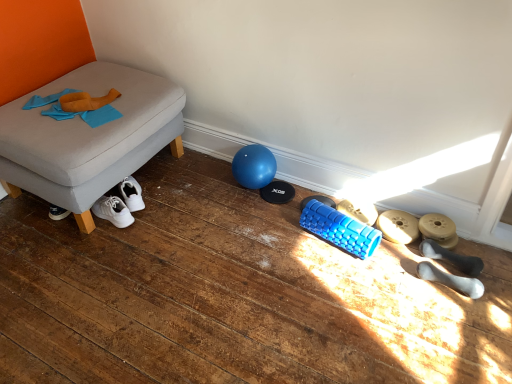
Question: Considering the relative sizes of matte gray dumbbell at lower right, which appears as the 4th footwear when viewed from the front, and white rubber dumbbell at lower right, which ranks as the first footwear in front-to-back order, in the image provided, is matte gray dumbbell at lower right, which appears as the 4th footwear when viewed from the front, wider than white rubber dumbbell at lower right, which ranks as the first footwear in front-to-back order,?

Choices:
 (A) yes
 (B) no

Answer: (A)

Question: Can you confirm if matte gray dumbbell at lower right, which appears as the 4th footwear when viewed from the front, is bigger than white rubber dumbbell at lower right, placed as the 5th footwear when sorted from back to front?

Choices:
 (A) no
 (B) yes

Answer: (A)

Question: Considering the relative positions of matte gray dumbbell at lower right, the 2th footwear positioned from the back, and white rubber dumbbell at lower right, which ranks as the first footwear in front-to-back order, in the image provided, is matte gray dumbbell at lower right, the 2th footwear positioned from the back, to the right of white rubber dumbbell at lower right, which ranks as the first footwear in front-to-back order, from the viewer's perspective?

Choices:
 (A) no
 (B) yes

Answer: (A)

Question: Are matte gray dumbbell at lower right, which appears as the 4th footwear when viewed from the front, and white rubber dumbbell at lower right, which ranks as the first footwear in front-to-back order, located far from each other?

Choices:
 (A) yes
 (B) no

Answer: (B)

Question: Considering the relative sizes of matte gray dumbbell at lower right, the 2th footwear positioned from the back, and white rubber dumbbell at lower right, placed as the 5th footwear when sorted from back to front, in the image provided, is matte gray dumbbell at lower right, the 2th footwear positioned from the back, thinner than white rubber dumbbell at lower right, placed as the 5th footwear when sorted from back to front,?

Choices:
 (A) yes
 (B) no

Answer: (B)

Question: Relative to matte gray dumbbell at lower right, which appears as the 4th footwear when viewed from the front, is white rubber dumbbell at lower right, placed as the 5th footwear when sorted from back to front, in front or behind?

Choices:
 (A) behind
 (B) front

Answer: (B)

Question: From a real-world perspective, is white rubber dumbbell at lower right, which ranks as the first footwear in front-to-back order, physically located above or below matte gray dumbbell at lower right, the 2th footwear positioned from the back?

Choices:
 (A) below
 (B) above

Answer: (B)

Question: Is white rubber dumbbell at lower right, placed as the 5th footwear when sorted from back to front, bigger or smaller than matte gray dumbbell at lower right, the 2th footwear positioned from the back?

Choices:
 (A) small
 (B) big

Answer: (B)

Question: From the image's perspective, is white rubber dumbbell at lower right, placed as the 5th footwear when sorted from back to front, above or below matte gray dumbbell at lower right, which appears as the 4th footwear when viewed from the front?

Choices:
 (A) above
 (B) below

Answer: (B)

Question: Is blue rubber roller at lower center, which ranks as the first footwear in back-to-front order, spatially inside matte gray dumbbell at lower right, the 2th footwear positioned from the back, or outside of it?

Choices:
 (A) outside
 (B) inside

Answer: (A)

Question: From a real-world perspective, is blue rubber roller at lower center, the fifth footwear positioned from the front, positioned above or below matte gray dumbbell at lower right, which appears as the 4th footwear when viewed from the front?

Choices:
 (A) below
 (B) above

Answer: (B)

Question: Considering the positions of blue rubber roller at lower center, which ranks as the first footwear in back-to-front order, and matte gray dumbbell at lower right, which appears as the 4th footwear when viewed from the front, in the image, is blue rubber roller at lower center, which ranks as the first footwear in back-to-front order, wider or thinner than matte gray dumbbell at lower right, which appears as the 4th footwear when viewed from the front,?

Choices:
 (A) wide
 (B) thin

Answer: (B)

Question: From their relative heights in the image, would you say blue rubber roller at lower center, the fifth footwear positioned from the front, is taller or shorter than matte gray dumbbell at lower right, which appears as the 4th footwear when viewed from the front?

Choices:
 (A) short
 (B) tall

Answer: (A)

Question: Is gray fabric ottoman at left to the left or to the right of white rubber dumbbells at lower right, the 2th footwear from the front, in the image?

Choices:
 (A) right
 (B) left

Answer: (B)

Question: Based on their sizes in the image, would you say gray fabric ottoman at left is bigger or smaller than white rubber dumbbells at lower right, the 4th footwear from the back?

Choices:
 (A) big
 (B) small

Answer: (A)